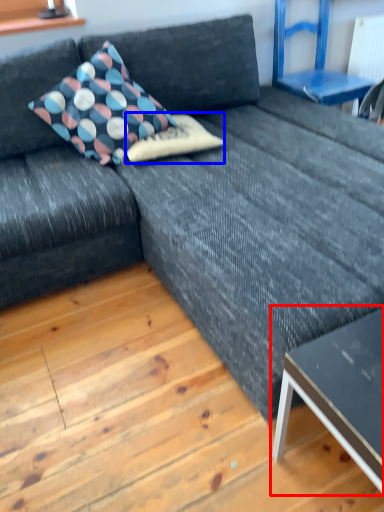
Question: Which point is further to the camera, table (highlighted by a red box) or pillow (highlighted by a blue box)?

Choices:
 (A) table
 (B) pillow

Answer: (B)